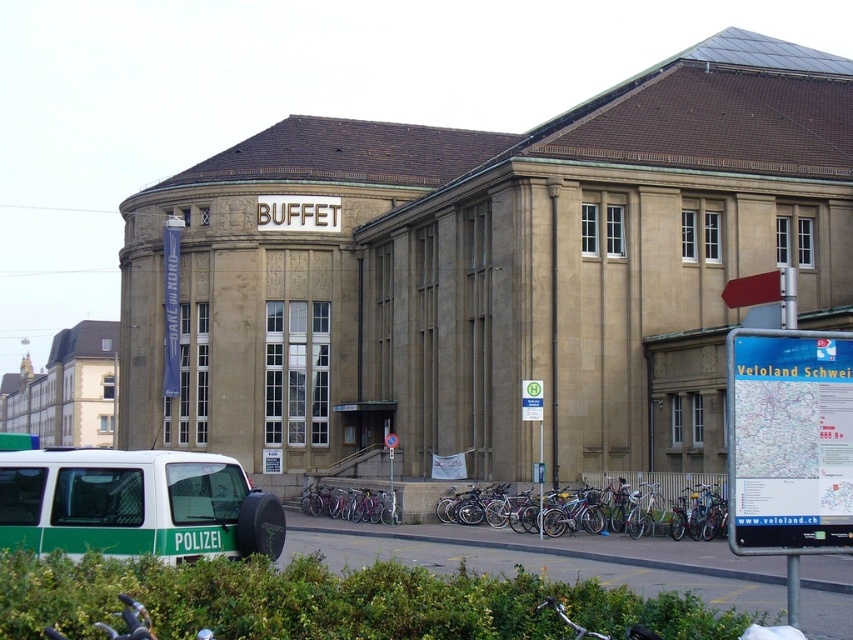
Question: Considering the real-world distances, which object is closest to the silver metallic bicycle at center?

Choices:
 (A) green leafy bush at lower center
 (B) green matte van at lower left
 (C) purple metallic bicycle at center

Answer: (C)

Question: Which of the following is the closest to the observer?

Choices:
 (A) (155, 515)
 (B) (677, 486)

Answer: (A)

Question: Can you confirm if green matte van at lower left is bigger than purple metallic bicycle at center?

Choices:
 (A) yes
 (B) no

Answer: (B)

Question: Does green leafy bush at lower center have a larger size compared to silver metallic bicycle at center?

Choices:
 (A) no
 (B) yes

Answer: (A)

Question: In this image, where is green matte van at lower left located relative to silver metallic bicycle at center?

Choices:
 (A) right
 (B) left

Answer: (B)

Question: Among these points, which one is farthest from the camera?

Choices:
 (A) (3, 468)
 (B) (672, 600)

Answer: (A)